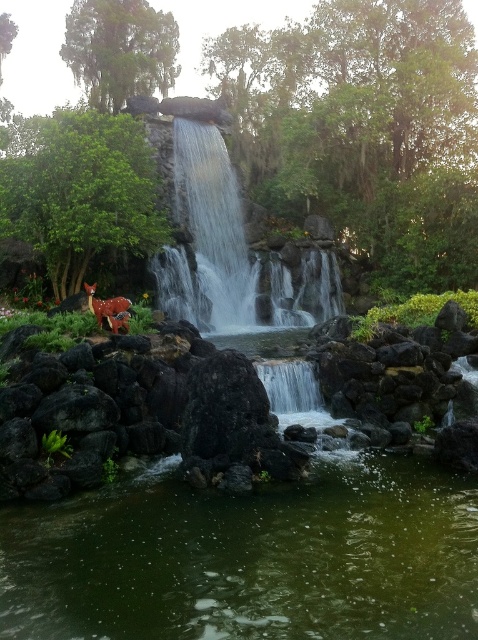
Question: Does clear water at center have a lesser width compared to spotted deer at lower left?

Choices:
 (A) yes
 (B) no

Answer: (B)

Question: Which point appears closest to the camera in this image?

Choices:
 (A) (207, 228)
 (B) (176, 314)
 (C) (95, 600)

Answer: (C)

Question: Does clear water at center have a lesser width compared to spotted deer at lower left?

Choices:
 (A) yes
 (B) no

Answer: (B)

Question: Can you confirm if clear water at center is wider than translucent glass waterfall at center?

Choices:
 (A) no
 (B) yes

Answer: (B)

Question: Estimate the real-world distances between objects in this image. Which object is closer to the green liquid water at center bottom?

Choices:
 (A) clear water at center
 (B) translucent glass waterfall at center

Answer: (A)

Question: Among these objects, which one is nearest to the camera?

Choices:
 (A) translucent glass waterfall at center
 (B) clear water at center

Answer: (B)